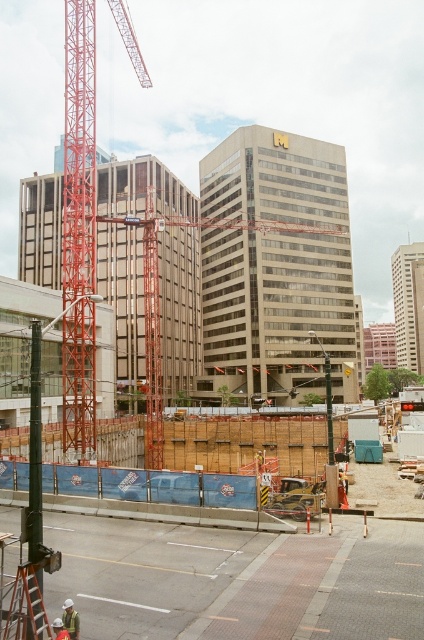
You are standing at the construction site and want to walk from the point at coordinates point (x=359, y=593) to the point at coordinates point (x=81, y=230). Which direction should you move relative to the construction cranes?

Since point (x=359, y=593) is in front of point (x=81, y=230), you should move backward away from the construction cranes to reach the point at coordinates point (x=81, y=230).